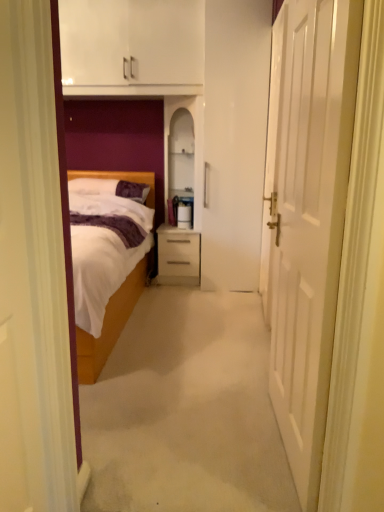
What is the approximate width of matte white drawer at center?

It is 19.26 inches.

In order to face white soft pillow at center, should I rotate leftwards or rightwards?

It's best to rotate left around 11.497 degrees.

The width and height of the screenshot is (384, 512). In order to click on white matte door at right in this screenshot , I will do point(307,216).

This screenshot has height=512, width=384. What do you see at coordinates (307, 216) in the screenshot?
I see `white matte door at right` at bounding box center [307, 216].

At what (x,y) coordinates should I click in order to perform the action: click on matte white drawer at center. Please return your answer as a coordinate pair (x, y). Looking at the image, I should click on (179, 254).

Between white soft pillow at center and matte white drawer at center, which one has larger width?

Wider between the two is matte white drawer at center.

Is white soft pillow at center completely or partially outside of matte white drawer at center?

Indeed, white soft pillow at center is completely outside matte white drawer at center.

What's the angular difference between white soft pillow at center and matte white drawer at center's facing directions?

1.75 degrees separate the facing orientations of white soft pillow at center and matte white drawer at center.

Is white soft pillow at center not close to matte white drawer at center?

No, white soft pillow at center is not far away from matte white drawer at center.

How many degrees apart are the facing directions of matte white drawer at center and wooden bed at left?

The facing directions of matte white drawer at center and wooden bed at left are 1.07 degrees apart.

From a real-world perspective, which object rests below the other?

matte white drawer at center is physically lower.

Which object is positioned more to the left, matte white drawer at center or wooden bed at left?

Positioned to the left is wooden bed at left.

How far apart are matte white drawer at center and wooden bed at left?

The distance of matte white drawer at center from wooden bed at left is 26.31 inches.

Considering the relative positions of wooden bed at left and white soft pillow at center in the image provided, is wooden bed at left behind white soft pillow at center?

No, wooden bed at left is in front of white soft pillow at center.

How many degrees apart are the facing directions of wooden bed at left and white soft pillow at center?

There is a 0.686-degree angle between the facing directions of wooden bed at left and white soft pillow at center.

Looking at this image, is there a large distance between wooden bed at left and white soft pillow at center?

Actually, wooden bed at left and white soft pillow at center are a little close together.

Is wooden bed at left turned away from white soft pillow at center?

Yes, wooden bed at left is positioned with its back facing white soft pillow at center.

Between point (154, 186) and point (186, 261), which one is positioned behind?

The point (154, 186) is farther.

Is wooden bed at left not near matte white drawer at center?

No, wooden bed at left is in close proximity to matte white drawer at center.

In the scene shown: Considering the sizes of objects wooden bed at left and matte white drawer at center in the image provided, who is thinner, wooden bed at left or matte white drawer at center?

With smaller width is matte white drawer at center.

Considering the sizes of matte white drawer at center and white matte door at right in the image, is matte white drawer at center wider or thinner than white matte door at right?

Considering their sizes, matte white drawer at center looks broader than white matte door at right.

Is matte white drawer at center touching white matte door at right?

matte white drawer at center and white matte door at right are clearly separated.

Would you say matte white drawer at center contains white matte door at right?

No, white matte door at right is not a part of matte white drawer at center.

Measure the distance between matte white drawer at center and white matte door at right.

The distance of matte white drawer at center from white matte door at right is 1.97 meters.

From the image's perspective, which object appears higher, white soft pillow at center or white matte door at right?

white soft pillow at center, from the image's perspective.

From a real-world perspective, does white soft pillow at center stand above white matte door at right?

No, from a real-world perspective, white soft pillow at center is not over white matte door at right

Who is bigger, white soft pillow at center or white matte door at right?

white matte door at right.

Between white matte door at right and wooden bed at left, which one is positioned behind?

wooden bed at left is behind.

Is white matte door at right at the left side of wooden bed at left?

No, white matte door at right is not to the left of wooden bed at left.

Find the location of a particular element. This screenshot has width=384, height=512. door on the right side of wooden bed at left is located at coordinates (307, 216).

Is white matte door at right oriented towards wooden bed at left?

Yes, white matte door at right faces towards wooden bed at left.

Find the location of a particular element. pillow that is on the left side of matte white drawer at center is located at coordinates (110, 188).

Identify the location of drawer behind the wooden bed at left. (179, 254).

Which object lies nearer to the anchor point matte white drawer at center, white matte door at right or white soft pillow at center?

white soft pillow at center is closer to matte white drawer at center.

From the image, which object appears to be nearer to white matte door at right, white soft pillow at center or wooden bed at left?

Based on the image, wooden bed at left appears to be nearer to white matte door at right.

Looking at the image, which one is located further to white matte door at right, matte white drawer at center or white soft pillow at center?

white soft pillow at center lies further to white matte door at right than the other object.

Looking at the image, which one is located further to matte white drawer at center, wooden bed at left or white matte door at right?

white matte door at right.

Looking at the image, which one is located closer to white soft pillow at center, matte white drawer at center or wooden bed at left?

The object closer to white soft pillow at center is matte white drawer at center.

When comparing their distances from white soft pillow at center, does white matte door at right or matte white drawer at center seem further?

white matte door at right.

Considering their positions, is matte white drawer at center positioned closer to wooden bed at left than white matte door at right?

Based on the image, matte white drawer at center appears to be nearer to wooden bed at left.

Based on their spatial positions, is wooden bed at left or matte white drawer at center further from white soft pillow at center?

wooden bed at left.

Where is `pillow located between wooden bed at left and matte white drawer at center in the depth direction`? pillow located between wooden bed at left and matte white drawer at center in the depth direction is located at coordinates (110, 188).

Locate an element on the screen. The width and height of the screenshot is (384, 512). bed between white matte door at right and matte white drawer at center along the z-axis is located at coordinates (110, 326).

Where is `bed between white matte door at right and white soft pillow at center along the z-axis`? bed between white matte door at right and white soft pillow at center along the z-axis is located at coordinates (110, 326).

Identify the location of pillow located between white matte door at right and matte white drawer at center in the depth direction. This screenshot has height=512, width=384. (110, 188).